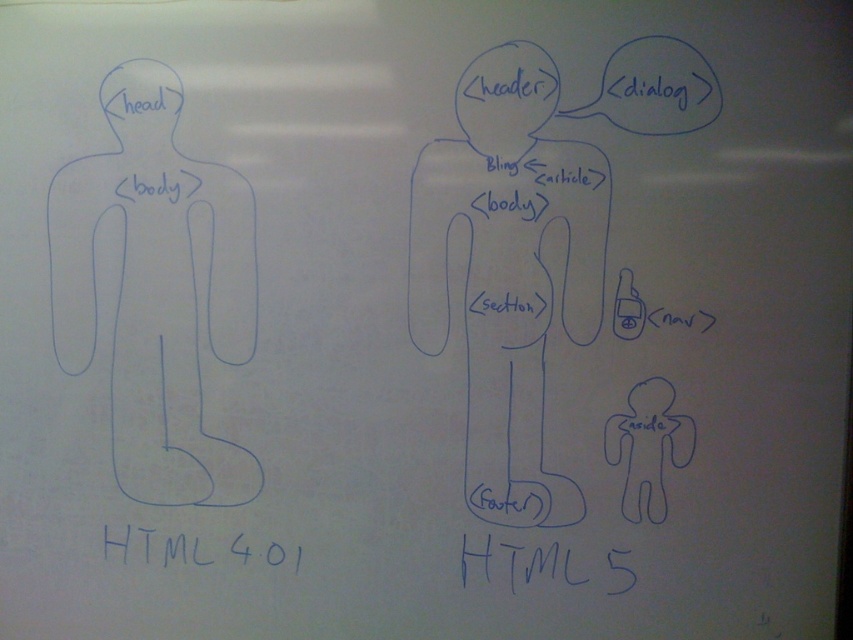
Who is more distant from viewer, (144, 356) or (509, 586)?

Positioned behind is point (144, 356).

Does blue line drawing of body at left appear over blue handwritten text at bottom center?

Correct, blue line drawing of body at left is located above blue handwritten text at bottom center.

Does point (112, 266) lie in front of point (567, 570)?

That is False.

You are a GUI agent. You are given a task and a screenshot of the screen. Output one action in this format:
    pyautogui.click(x=<x>, y=<y>)
    Task: Click on the blue line drawing of body at left
    This screenshot has height=640, width=853.
    Given the screenshot: What is the action you would take?
    pyautogui.click(x=155, y=291)

Does blue line drawing body at center have a greater height compared to blue handwritten text at bottom center?

Yes, blue line drawing body at center is taller than blue handwritten text at bottom center.

Which is in front, point (479, 164) or point (540, 547)?

Positioned in front is point (479, 164).

Locate an element on the screen. This screenshot has width=853, height=640. blue line drawing body at center is located at coordinates (508, 272).

Does black text at lower left appear over blue handwritten text at bottom center?

Indeed, black text at lower left is positioned over blue handwritten text at bottom center.

Is black text at lower left to the right of blue handwritten text at bottom center from the viewer's perspective?

Incorrect, black text at lower left is not on the right side of blue handwritten text at bottom center.

Which is behind, point (148, 531) or point (608, 592)?

Point (148, 531)

You are a GUI agent. You are given a task and a screenshot of the screen. Output one action in this format:
    pyautogui.click(x=<x>, y=<y>)
    Task: Click on the black text at lower left
    The height and width of the screenshot is (640, 853).
    Given the screenshot: What is the action you would take?
    pyautogui.click(x=193, y=548)